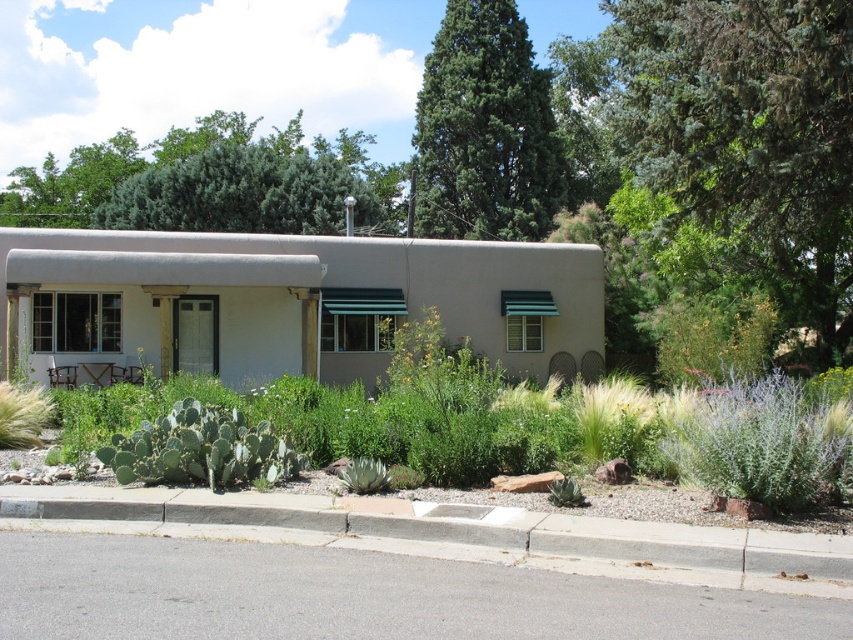
Question: Estimate the real-world distances between objects in this image. Which object is closer to the green needle-like foliage at upper center?

Choices:
 (A) green textured tree at upper center
 (B) gray concrete curb at lower center

Answer: (A)

Question: Which point is closer to the camera?

Choices:
 (A) (74, 160)
 (B) (131, 433)

Answer: (B)

Question: From the image, what is the correct spatial relationship of gray concrete curb at lower center in relation to green needle-like foliage at upper center?

Choices:
 (A) left
 (B) right

Answer: (A)

Question: Is green needle-like foliage at upper center thinner than green spiny cactus at lower center?

Choices:
 (A) no
 (B) yes

Answer: (A)

Question: In this image, where is green leafy tree at upper right located relative to green needle-like foliage at upper center?

Choices:
 (A) above
 (B) below

Answer: (B)

Question: Which object appears farthest from the camera in this image?

Choices:
 (A) gray concrete curb at lower center
 (B) green textured tree at upper center
 (C) green leafy tree at upper right

Answer: (B)